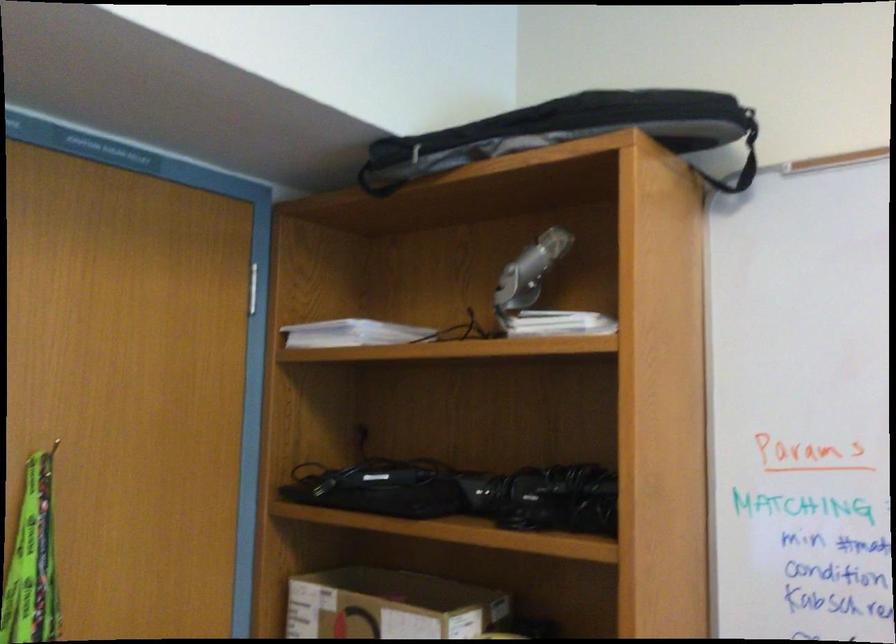
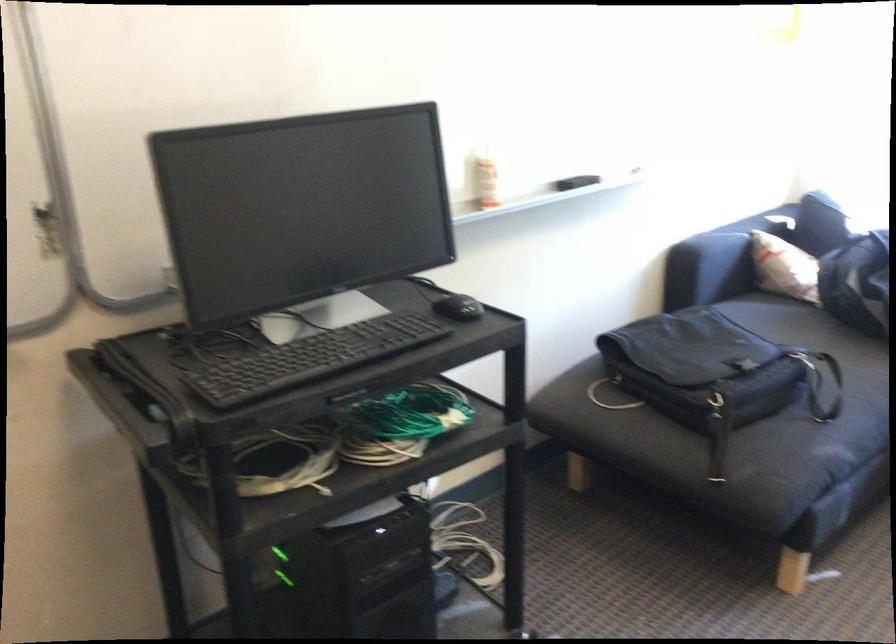
How did the camera likely rotate?

The camera's rotation is toward right-down.